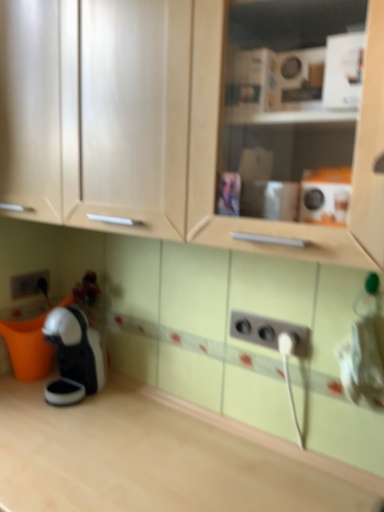
Locate an element on the screen. This screenshot has width=384, height=512. free location to the right of black plastic coffee machine at lower left is located at coordinates (127, 401).